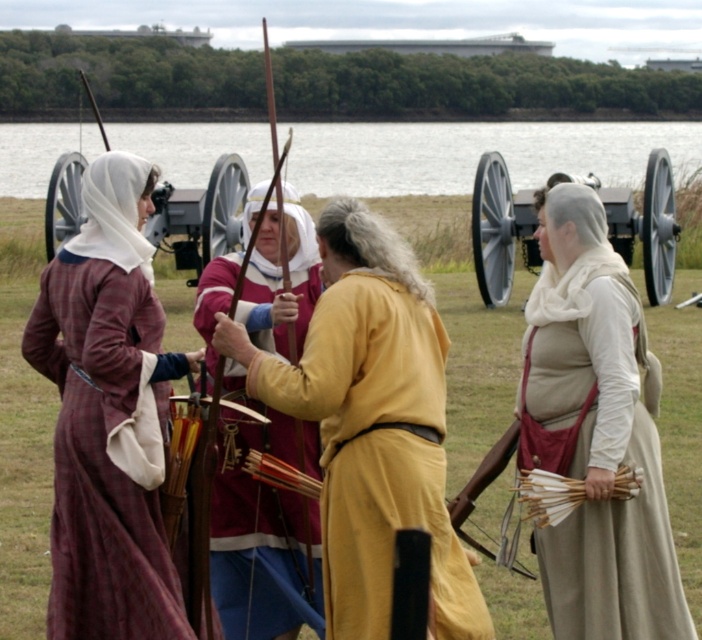
Based on the photo, you are organizing a historical reenactment and need to arrange participants in a straight line. The maroon velvet tunic at center and beige woolen vest at right are currently 1.30 meters apart. If you want them to stand exactly 1 meter apart for the procession, should you move them closer or farther apart?

The maroon velvet tunic at center and beige woolen vest at right are currently 1.30 meters apart. To achieve the desired 1 meter distance, they should move closer to each other by 0.30 meters.